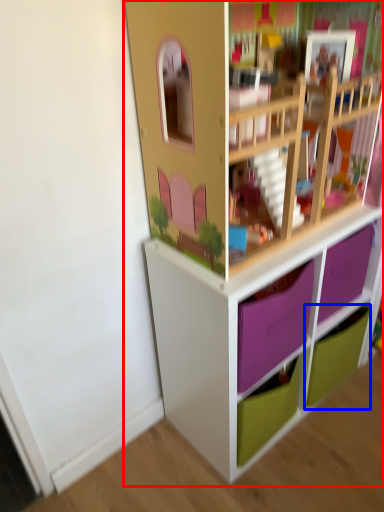
Question: Among these objects, which one is nearest to the camera, shelf (highlighted by a red box) or drawer (highlighted by a blue box)?

Choices:
 (A) shelf
 (B) drawer

Answer: (A)